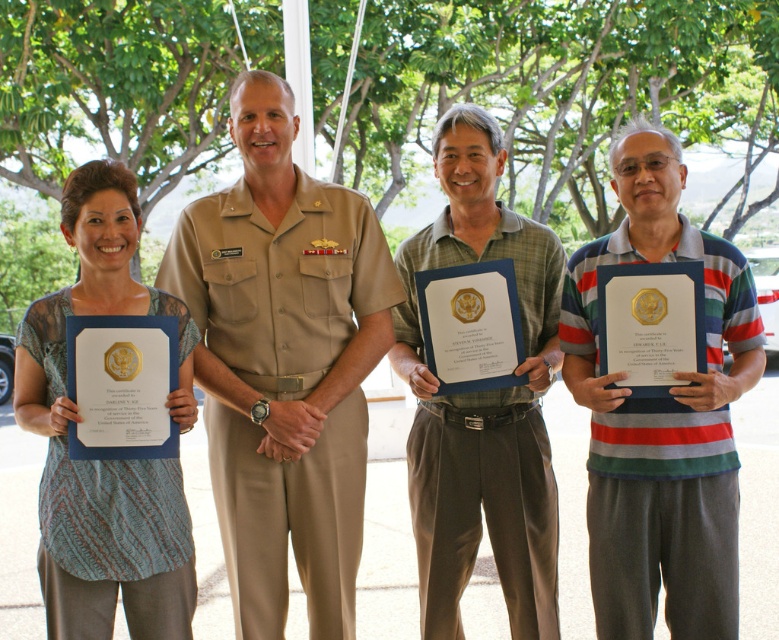
Question: Is tan uniform at center to the right of striped cotton polo shirt at right from the viewer's perspective?

Choices:
 (A) no
 (B) yes

Answer: (A)

Question: Can you confirm if tan uniform at center is positioned to the left of striped cotton polo shirt at right?

Choices:
 (A) no
 (B) yes

Answer: (B)

Question: Does tan uniform at center have a lesser width compared to green fabric shirt at center?

Choices:
 (A) no
 (B) yes

Answer: (A)

Question: Which of the following is the farthest from the observer?

Choices:
 (A) (711, 538)
 (B) (182, 413)

Answer: (A)

Question: Estimate the real-world distances between objects in this image. Which object is closer to the green fabric shirt at center?

Choices:
 (A) striped cotton polo shirt at right
 (B) tan uniform at center
 (C) printed fabric shirt at center

Answer: (A)

Question: Considering the real-world distances, which object is closest to the striped cotton polo shirt at right?

Choices:
 (A) green fabric shirt at center
 (B) printed fabric shirt at center

Answer: (A)